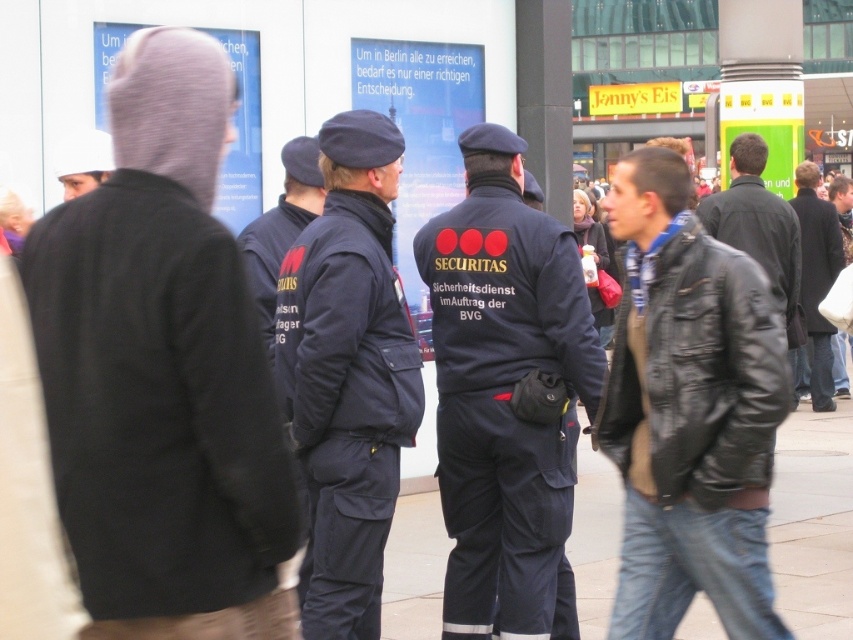
You are a pedestrian in the scene. There is a point at coordinate (161, 371). What object is this point located on?

The point at coordinate (161, 371) is located on the knit gray beanie at upper left.

In the scene shown: You are a pedestrian in the scene. You see a leather jacket at center. Where is the leather jacket located in the scene?

The leather jacket at center is located at point [689,412].

You are a delivery person trying to place a small package on the ground. You see the leather jacket at center and the smooth concrete pavement at center. Which surface can you place the package on?

The smooth concrete pavement at center is a suitable surface to place the package because the leather jacket at center is bigger than the smooth concrete pavement at center, meaning the pavement is smaller and not a stable surface for placing items.